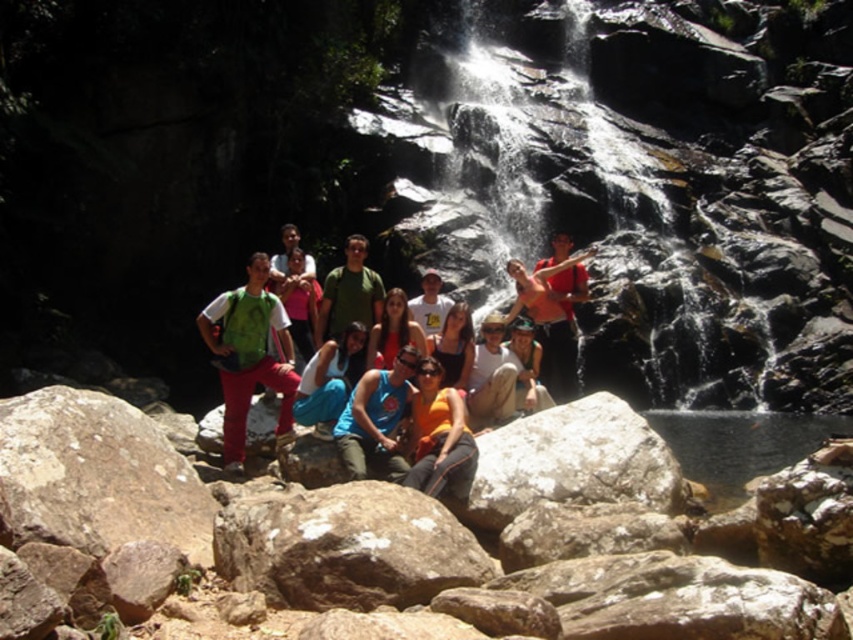
Does gray rough rock at lower left have a lesser height compared to blue fabric tank top at center?

No.

The width and height of the screenshot is (853, 640). Describe the element at coordinates (97, 476) in the screenshot. I see `gray rough rock at lower left` at that location.

You are a GUI agent. You are given a task and a screenshot of the screen. Output one action in this format:
    pyautogui.click(x=<x>, y=<y>)
    Task: Click on the gray rough rock at lower left
    
    Given the screenshot: What is the action you would take?
    pyautogui.click(x=97, y=476)

Which is below, rocky brown at center or orange fabric at center?

rocky brown at center

Does rocky brown at center have a larger size compared to orange fabric at center?

Indeed, rocky brown at center has a larger size compared to orange fabric at center.

I want to click on rocky brown at center, so click(x=341, y=545).

Between matte green backpack at center and green fabric backpack at center, which one appears on the left side from the viewer's perspective?

Positioned to the left is green fabric backpack at center.

Does point (242, 317) lie behind point (265, 336)?

No, (242, 317) is in front of (265, 336).

Where is `matte green backpack at center`? Image resolution: width=853 pixels, height=640 pixels. matte green backpack at center is located at coordinates (250, 356).